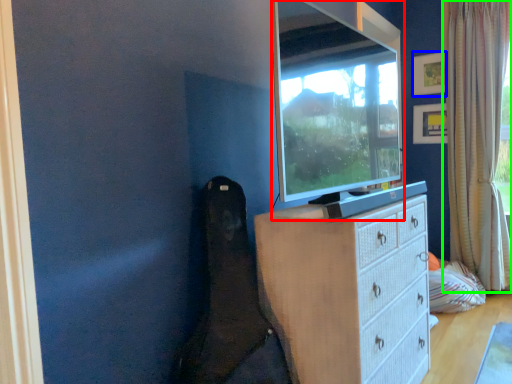
Question: Based on their relative distances, which object is nearer to television (highlighted by a red box)? Choose from picture frame (highlighted by a blue box) and curtain (highlighted by a green box).

Choices:
 (A) picture frame
 (B) curtain

Answer: (B)